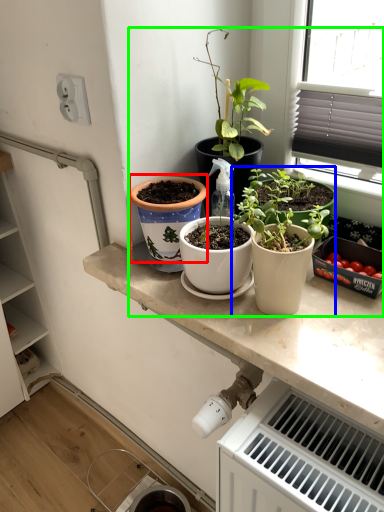
Question: Considering the real-world distances, which object is farthest from flowerpot (highlighted by a red box)? houseplant (highlighted by a blue box) or vegetable garden (highlighted by a green box)?

Choices:
 (A) houseplant
 (B) vegetable garden

Answer: (B)